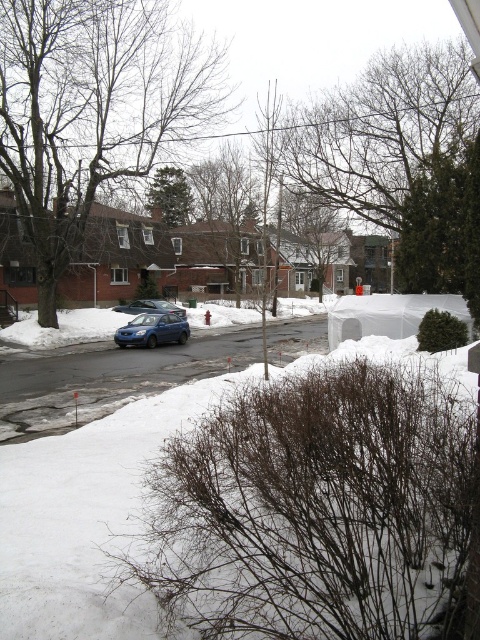
Which is in front, point (211, 404) or point (171, 326)?

Point (211, 404) is in front.

The width and height of the screenshot is (480, 640). What do you see at coordinates (87, 516) in the screenshot? I see `white fluffy snow at lower left` at bounding box center [87, 516].

The height and width of the screenshot is (640, 480). What are the coordinates of `white fluffy snow at lower left` in the screenshot? It's located at (87, 516).

Which of these two, white fluffy snow at lower left or satin blue sedan at center, stands shorter?

Standing shorter between the two is satin blue sedan at center.

Is white fluffy snow at lower left to the right of satin blue sedan at center from the viewer's perspective?

Yes, white fluffy snow at lower left is to the right of satin blue sedan at center.

Image resolution: width=480 pixels, height=640 pixels. What do you see at coordinates (87, 516) in the screenshot?
I see `white fluffy snow at lower left` at bounding box center [87, 516].

Image resolution: width=480 pixels, height=640 pixels. Find the location of `white fluffy snow at lower left`. white fluffy snow at lower left is located at coordinates (87, 516).

Is the position of matte blue van at center less distant than that of satin blue sedan at center?

Yes, matte blue van at center is in front of satin blue sedan at center.

Between matte blue van at center and satin blue sedan at center, which one appears on the left side from the viewer's perspective?

From the viewer's perspective, satin blue sedan at center appears more on the left side.

Locate an element on the screen. matte blue van at center is located at coordinates (153, 330).